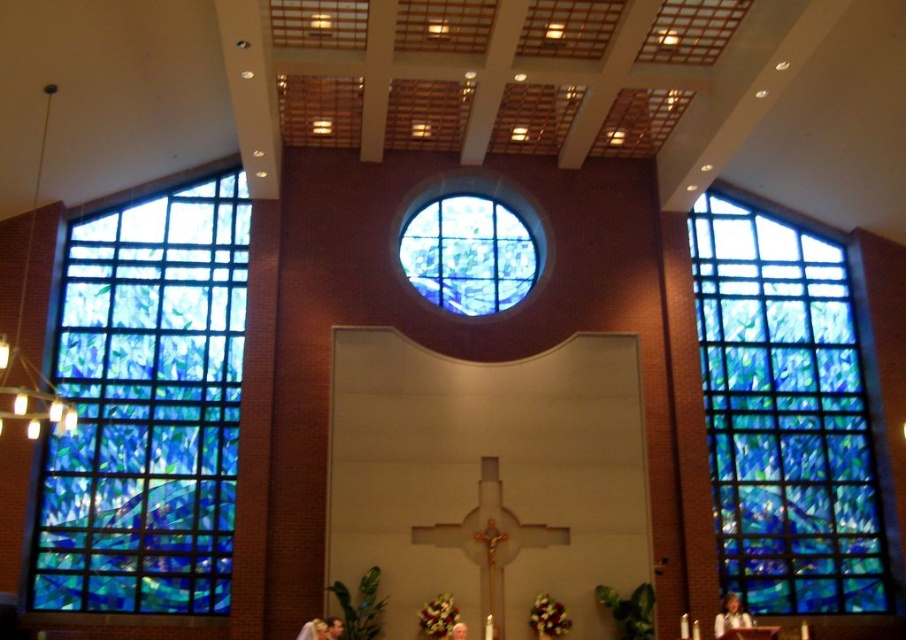
You are standing in the church and want to take a photo of both the stained glass window at left and the blue stained glass window at right. Which one is positioned higher in the church? Please describe their positions relative to each other.

The stained glass window at left is located above the blue stained glass window at right, meaning it is positioned higher up in the church compared to the blue stained glass window at right.

You are standing in the church and want to take a photo of both the stained glass window at left and the blue stained glass window at center. Which one should you stand closer to in order to capture both in a single frame?

To capture both the stained glass window at left and the blue stained glass window at center in a single frame, you should stand closer to the stained glass window at left since it is farther away from the blue stained glass window at center, requiring a wider angle or positioning closer to accommodate both in the frame.

You are an architect designing a new church and want to ensure the stained glass windows are proportionate. Given the stained glass window at left and the blue stained glass window at center, which one has a greater width?

The stained glass window at left has a greater width than the blue stained glass window at center.